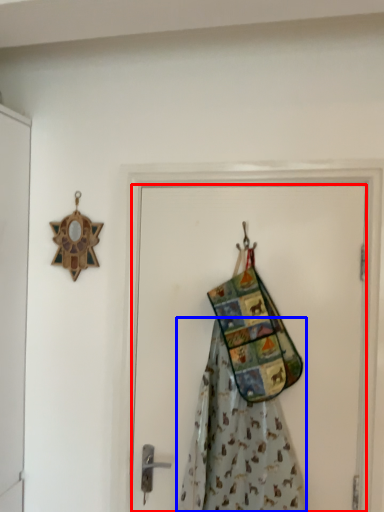
Question: Which of the following is the farthest to the observer, door (highlighted by a red box) or fancy dress (highlighted by a blue box)?

Choices:
 (A) door
 (B) fancy dress

Answer: (A)